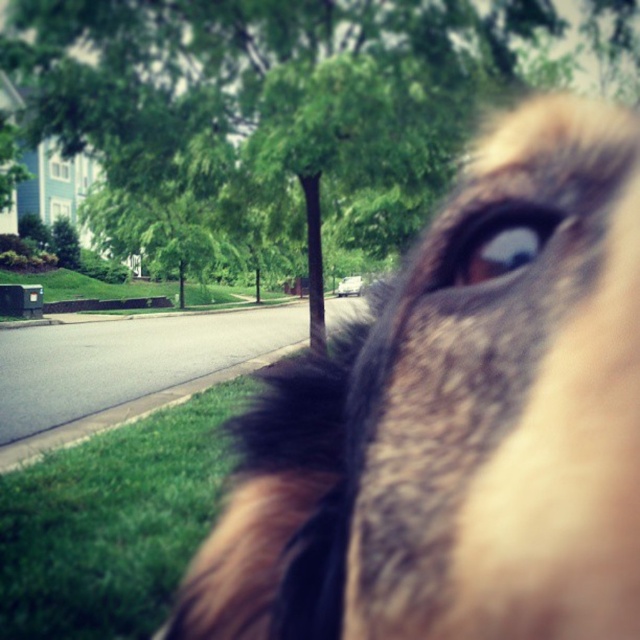
You are a photographer trying to capture a close shot of the brown fur eye at upper right. The brown furry dog at upper right is moving slightly. Which object would you need to focus on first to ensure the eye stays in frame?

You should focus on the brown fur eye at upper right first because it is the smaller and more critical detail, ensuring it stays centered even if the brown furry dog at upper right moves slightly.

You are a photographer trying to focus on two points in the image of a dog and a suburban street. The points are labeled as point (362, 458) and point (323, 93). Which point is closer to your camera lens?

Point (362, 458) is closer to the camera lens than point (323, 93).

You are taking a photo of a dog and a street scene. You notice two points in the image labeled as point (12, 65) and point (508, 248). Which point is closer to the camera?

Point (12, 65) is further to the camera than point (508, 248), so the closer point to the camera is point (508, 248).